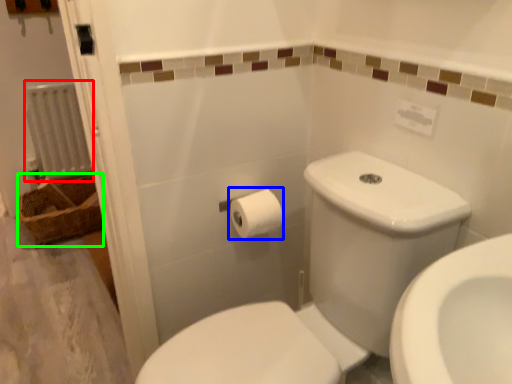
Question: Which object is positioned closest to radiator (highlighted by a red box)? Select from toilet paper (highlighted by a blue box) and basket (highlighted by a green box).

Choices:
 (A) toilet paper
 (B) basket

Answer: (B)